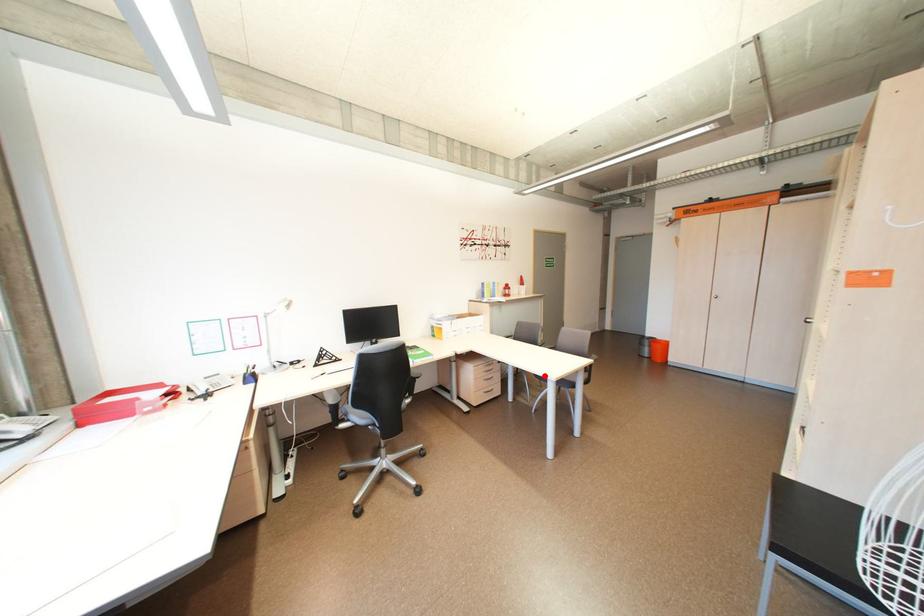
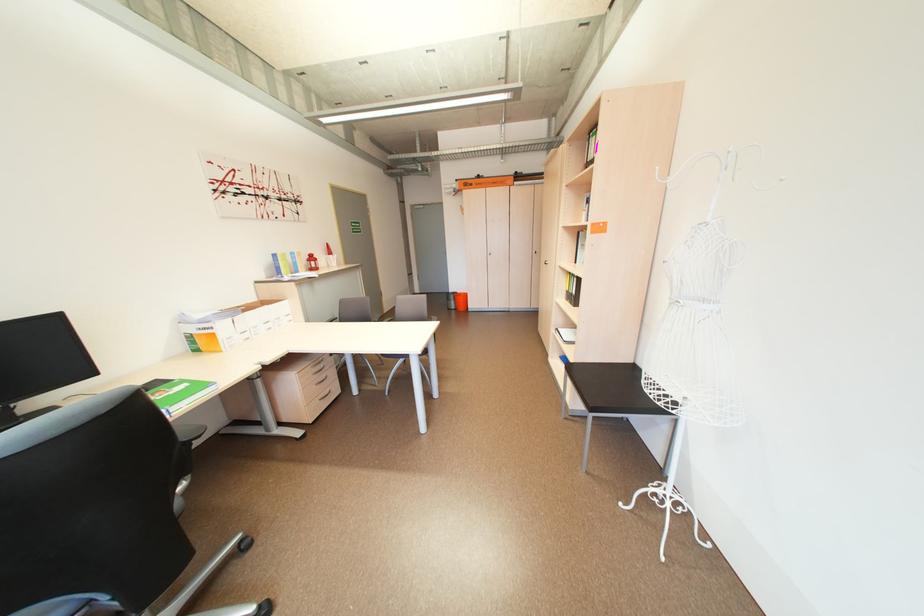
Question: I am providing you with two images of the same scene from different viewpoints. Given a red point in image1, look at the same physical point in image2. Is it:

Choices:
 (A) Closer to the viewpoint
 (B) Farther from the viewpoint

Answer: (B)